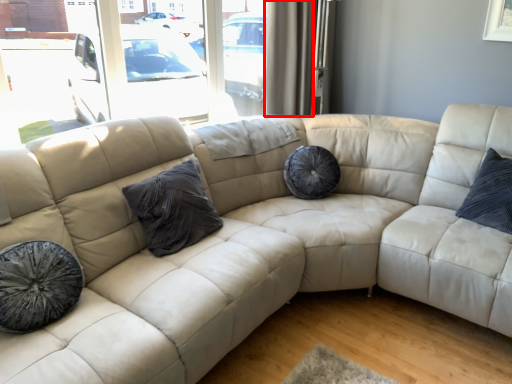
Question: Observing the image, what is the correct spatial positioning of curtain (annotated by the red box) in reference to pillow?

Choices:
 (A) right
 (B) left

Answer: (A)